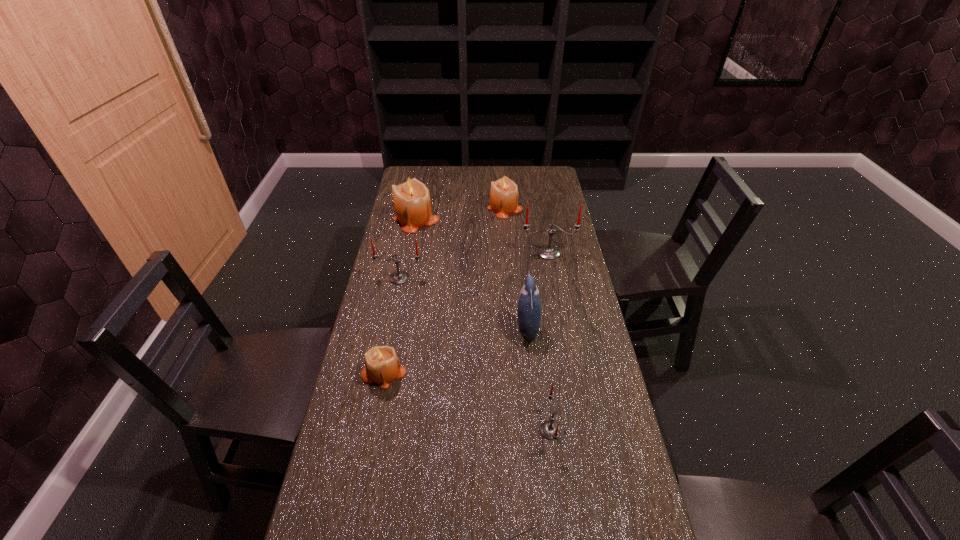
Where is `the third farthest object`? Image resolution: width=960 pixels, height=540 pixels. the third farthest object is located at coordinates (548, 252).

The width and height of the screenshot is (960, 540). I want to click on the biggest red candle, so click(x=548, y=252).

Locate an element on the screen. the biggest beige candle is located at coordinates (412, 205).

In order to click on blue bird in this screenshot , I will do `click(529, 304)`.

Locate an element on the screen. This screenshot has height=540, width=960. bird is located at coordinates (529, 304).

This screenshot has height=540, width=960. I want to click on the second farthest red candle, so click(399, 277).

This screenshot has width=960, height=540. What are the coordinates of `the fifth nearest object` in the screenshot? It's located at coord(399,277).

I want to click on the second biggest beige candle, so click(504, 194).

The height and width of the screenshot is (540, 960). I want to click on the seventh farthest object, so click(550, 430).

At what (x,y) coordinates should I click in order to perform the action: click on the nearest candle. Please return your answer as a coordinate pair (x, y). Looking at the image, I should click on (550, 430).